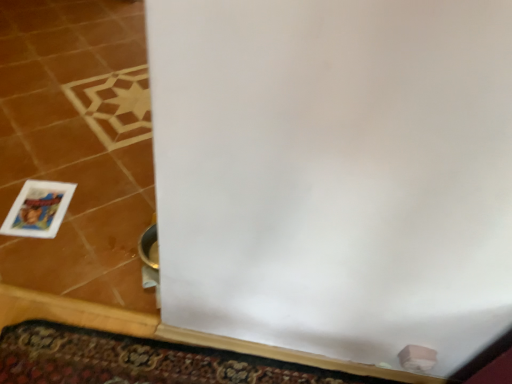
Question: Considering their positions, is carpeted doormat at lower center located in front of or behind matte plastic picture frame at lower left?

Choices:
 (A) front
 (B) behind

Answer: (A)

Question: From a real-world perspective, is carpeted doormat at lower center positioned above or below matte plastic picture frame at lower left?

Choices:
 (A) above
 (B) below

Answer: (A)

Question: Is carpeted doormat at lower center taller or shorter than matte plastic picture frame at lower left?

Choices:
 (A) tall
 (B) short

Answer: (B)

Question: Considering their positions, is matte plastic picture frame at lower left located in front of or behind carpeted doormat at lower center?

Choices:
 (A) behind
 (B) front

Answer: (A)

Question: From the image's perspective, relative to carpeted doormat at lower center, is matte plastic picture frame at lower left above or below?

Choices:
 (A) above
 (B) below

Answer: (A)

Question: Looking at their shapes, would you say matte plastic picture frame at lower left is wider or thinner than carpeted doormat at lower center?

Choices:
 (A) thin
 (B) wide

Answer: (B)

Question: From a real-world perspective, is matte plastic picture frame at lower left physically located above or below carpeted doormat at lower center?

Choices:
 (A) below
 (B) above

Answer: (A)